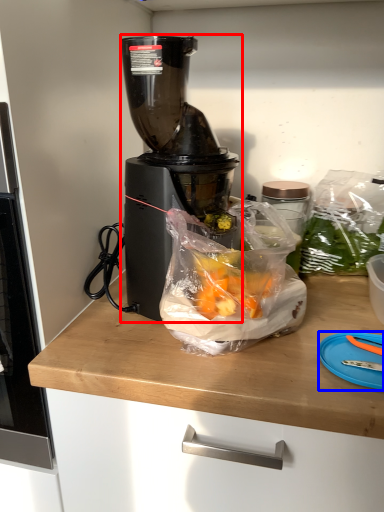
Question: Which object appears farthest to the camera in this image, blender (highlighted by a red box) or cutting board (highlighted by a blue box)?

Choices:
 (A) blender
 (B) cutting board

Answer: (A)